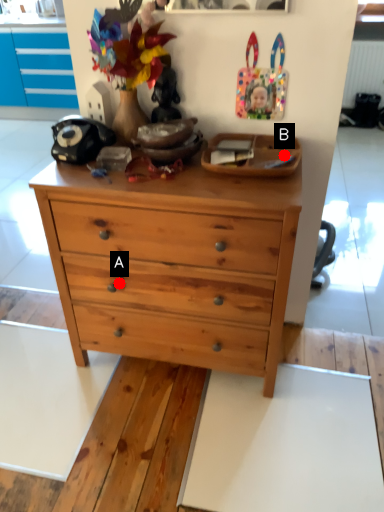
Question: Two points are circled on the image, labeled by A and B beside each circle. Which point is closer to the camera taking this photo?

Choices:
 (A) A is closer
 (B) B is closer

Answer: (B)